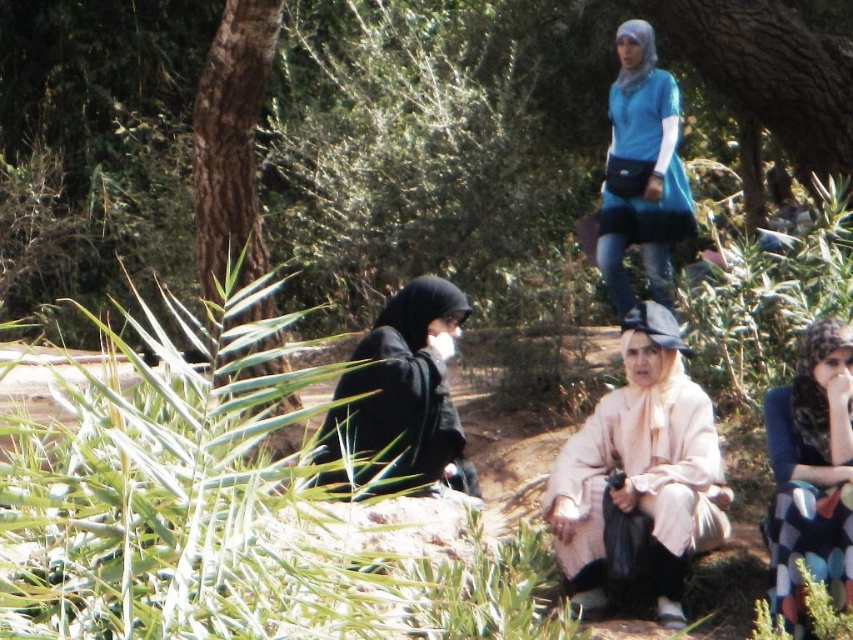
Question: Which of the following is the farthest from the observer?

Choices:
 (A) (219, 209)
 (B) (606, 476)
 (C) (793, 401)

Answer: (A)

Question: Which object is closer to the camera taking this photo?

Choices:
 (A) brown rough bark tree at left
 (B) light beige fabric coat at center
 (C) patterned fabric dress at lower right

Answer: (C)

Question: Considering the real-world distances, which object is closest to the black matte hijab at center?

Choices:
 (A) brown rough bark tree at left
 (B) light beige fabric coat at center
 (C) patterned fabric dress at lower right

Answer: (B)

Question: In this image, where is brown rough bark tree at left located relative to blue matte dress at upper center?

Choices:
 (A) above
 (B) below

Answer: (B)

Question: Does brown rough bark tree at left come behind black matte hijab at center?

Choices:
 (A) yes
 (B) no

Answer: (A)

Question: Does light beige fabric coat at center have a larger size compared to brown rough bark tree at left?

Choices:
 (A) yes
 (B) no

Answer: (B)